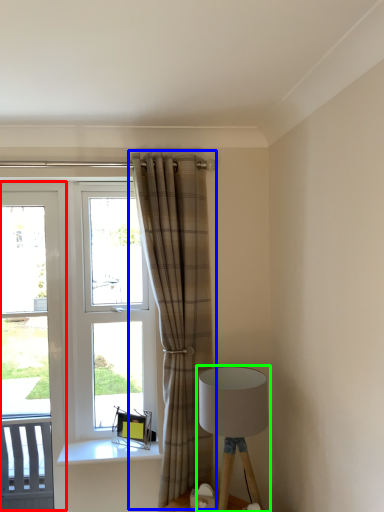
Question: Which is nearer to the screen door (highlighted by a red box)? curtain (highlighted by a blue box) or lamp (highlighted by a green box).

Choices:
 (A) curtain
 (B) lamp

Answer: (A)